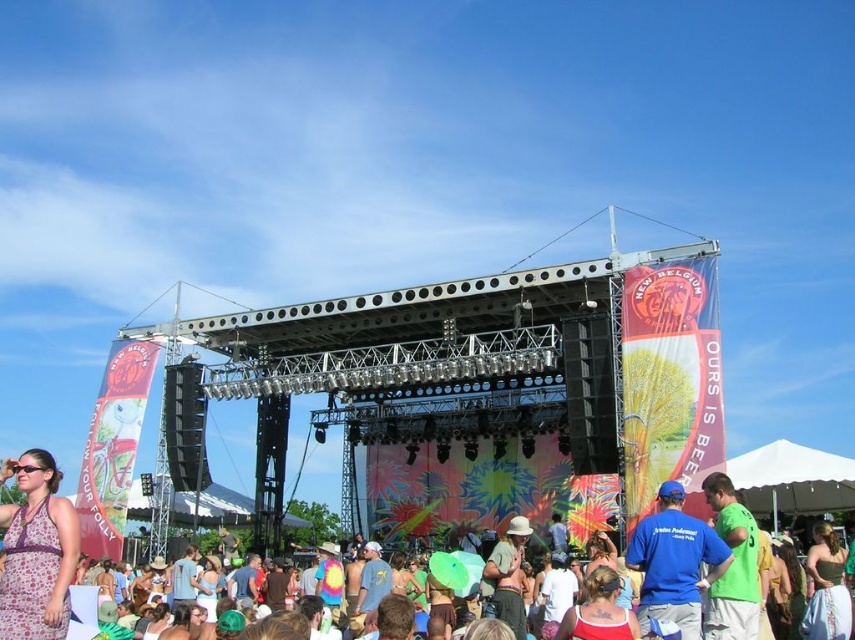
Question: Which object is closer to the camera taking this photo?

Choices:
 (A) blue cotton shirt at center
 (B) floral dress at lower left

Answer: (A)

Question: Observing the image, what is the correct spatial positioning of blue cotton shirt at center in reference to green fabric shirt at center?

Choices:
 (A) left
 (B) right

Answer: (A)

Question: Which of the following is the farthest from the observer?

Choices:
 (A) blue cotton shirt at center
 (B) green fabric shirt at center
 (C) floral dress at lower left

Answer: (C)

Question: Can you confirm if floral dress at lower left is thinner than green fabric shirt at center?

Choices:
 (A) yes
 (B) no

Answer: (B)

Question: Which object is farther from the camera taking this photo?

Choices:
 (A) blue cotton shirt at center
 (B) floral dress at lower left

Answer: (B)

Question: Is floral dress at lower left to the left of green fabric shirt at center from the viewer's perspective?

Choices:
 (A) yes
 (B) no

Answer: (A)